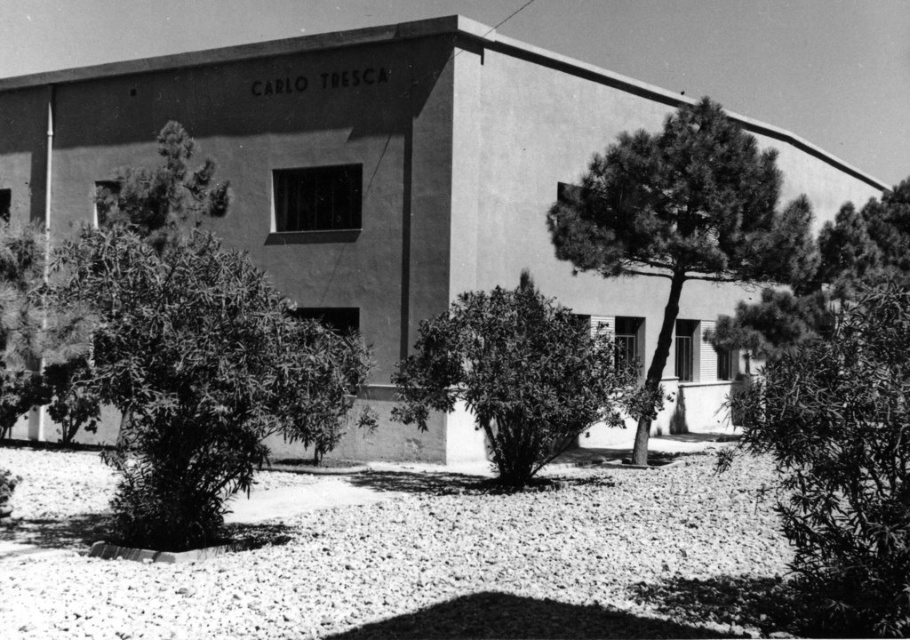
Which is more to the right, smooth green leaves at right or smooth green tree at center?

smooth green leaves at right is more to the right.

Does smooth green leaves at right have a larger size compared to smooth green tree at center?

Yes, smooth green leaves at right is bigger than smooth green tree at center.

You are a GUI agent. You are given a task and a screenshot of the screen. Output one action in this format:
    pyautogui.click(x=<x>, y=<y>)
    Task: Click on the smooth green leaves at right
    Image resolution: width=910 pixels, height=640 pixels.
    Given the screenshot: What is the action you would take?
    pyautogui.click(x=838, y=467)

At what (x,y) coordinates should I click in order to perform the action: click on smooth green tree at center. Please return your answer as a coordinate pair (x, y). Looking at the image, I should click on (681, 220).

Does smooth green tree at center appear on the right side of green leafy bush at center?

Indeed, smooth green tree at center is positioned on the right side of green leafy bush at center.

This screenshot has height=640, width=910. What are the coordinates of `smooth green tree at center` in the screenshot? It's located at (681, 220).

At what (x,y) coordinates should I click in order to perform the action: click on smooth green tree at center. Please return your answer as a coordinate pair (x, y). This screenshot has height=640, width=910. Looking at the image, I should click on (681, 220).

Is thick green foliage at center shorter than smooth green tree at center?

In fact, thick green foliage at center may be taller than smooth green tree at center.

You are a GUI agent. You are given a task and a screenshot of the screen. Output one action in this format:
    pyautogui.click(x=<x>, y=<y>)
    Task: Click on the thick green foliage at center
    The width and height of the screenshot is (910, 640).
    Given the screenshot: What is the action you would take?
    pyautogui.click(x=199, y=376)

Image resolution: width=910 pixels, height=640 pixels. I want to click on thick green foliage at center, so click(199, 376).